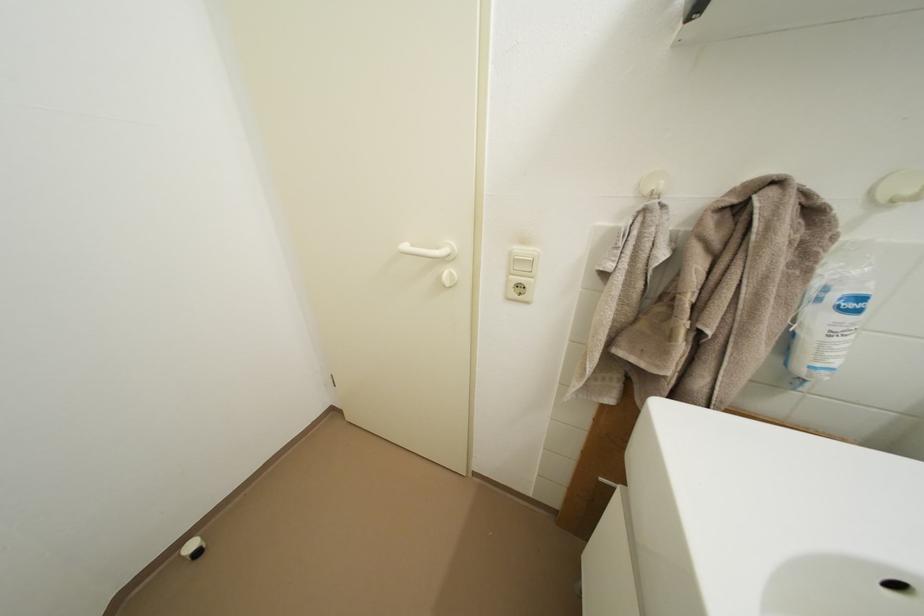
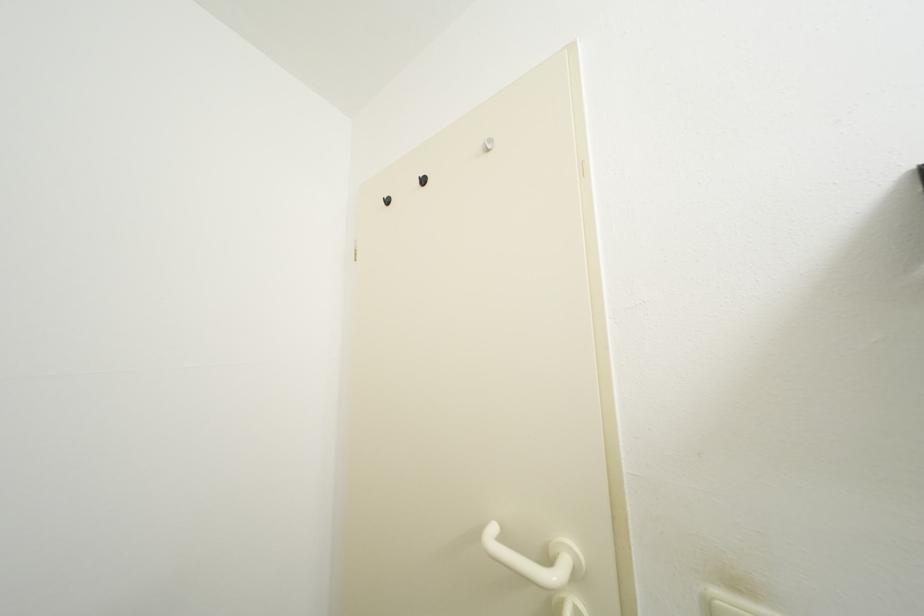
Question: Based on the continuous images, in which direction is the camera rotating? Reply with the corresponding letter.

Choices:
 (A) Left
 (B) Right
 (C) Up
 (D) Down

Answer: (C)